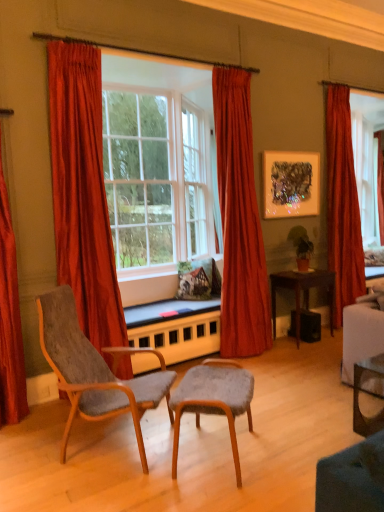
Image resolution: width=384 pixels, height=512 pixels. Identify the location of vacant area that lies in front of textured gray fabric chair at lower left, marked as the 2th chair in a right-to-left arrangement. (100, 490).